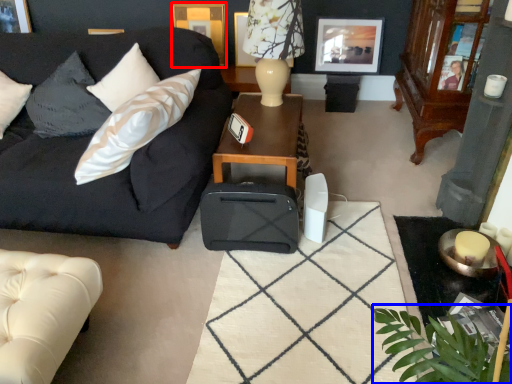
Question: Which object is closer to the camera taking this photo, picture frame (highlighted by a red box) or plant (highlighted by a blue box)?

Choices:
 (A) picture frame
 (B) plant

Answer: (B)